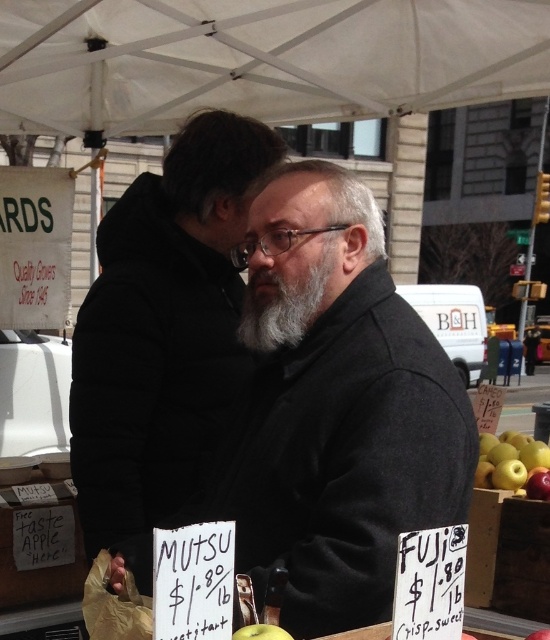
Question: Is gray matte beard at center bigger than green matte apples at lower right?

Choices:
 (A) no
 (B) yes

Answer: (A)

Question: Does gray matte beard at center have a smaller size compared to green matte apples at lower right?

Choices:
 (A) no
 (B) yes

Answer: (B)

Question: Which point is closer to the camera?

Choices:
 (A) green matte apple at lower center
 (B) gray matte beard at center

Answer: (A)

Question: Does green matte apples at lower right appear under green matte apple at lower center?

Choices:
 (A) yes
 (B) no

Answer: (A)

Question: Which object is farther from the camera taking this photo?

Choices:
 (A) green matte apples at lower right
 (B) green matte apple at lower center
 (C) dark gray wool coat at center

Answer: (A)

Question: Based on their relative distances, which object is farther from the white fabric canopy at upper center?

Choices:
 (A) gray matte beard at center
 (B) green matte apple at lower center
 (C) dark gray wool coat at center
 (D) green matte apples at lower right

Answer: (B)